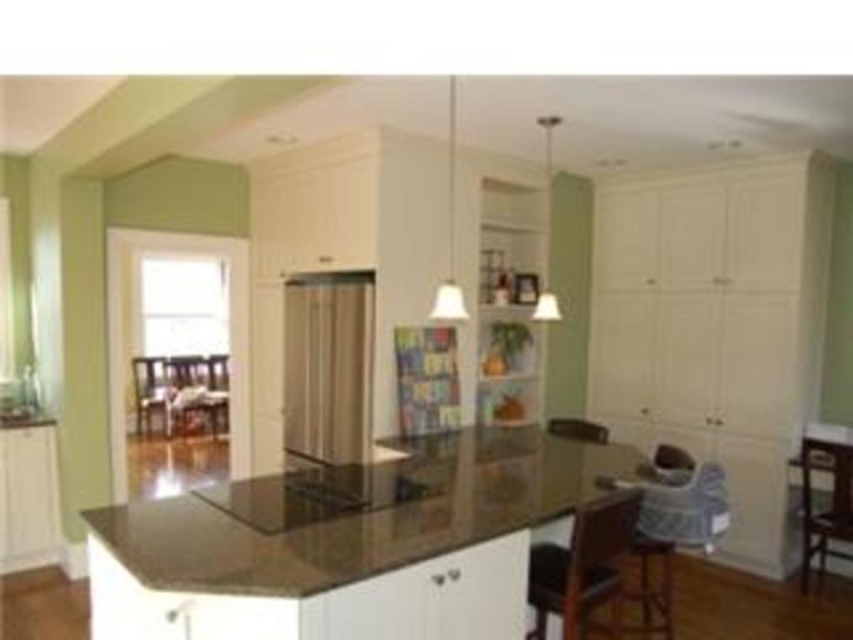
Is matte black chair at left bigger than wooden chair at center?

Indeed, matte black chair at left has a larger size compared to wooden chair at center.

Is point (158, 371) farther from camera compared to point (224, 396)?

Yes.

Where is `matte black chair at left`? The image size is (853, 640). matte black chair at left is located at coordinates (148, 388).

Measure the distance between point (354, 490) and camera.

Point (354, 490) is 3.50 meters away from camera.

Is brown granite counter top at center to the right of wooden bar stool at lower right from the viewer's perspective?

In fact, brown granite counter top at center is to the left of wooden bar stool at lower right.

The width and height of the screenshot is (853, 640). What do you see at coordinates (357, 513) in the screenshot?
I see `brown granite counter top at center` at bounding box center [357, 513].

Image resolution: width=853 pixels, height=640 pixels. I want to click on brown granite counter top at center, so coord(357,513).

Looking at this image, which of these two, blue fabric highchair at lower right or matte black chair at left, stands shorter?

With less height is matte black chair at left.

Where is `blue fabric highchair at lower right`? Image resolution: width=853 pixels, height=640 pixels. blue fabric highchair at lower right is located at coordinates (670, 534).

Where is `blue fabric highchair at lower right`? Image resolution: width=853 pixels, height=640 pixels. blue fabric highchair at lower right is located at coordinates (670, 534).